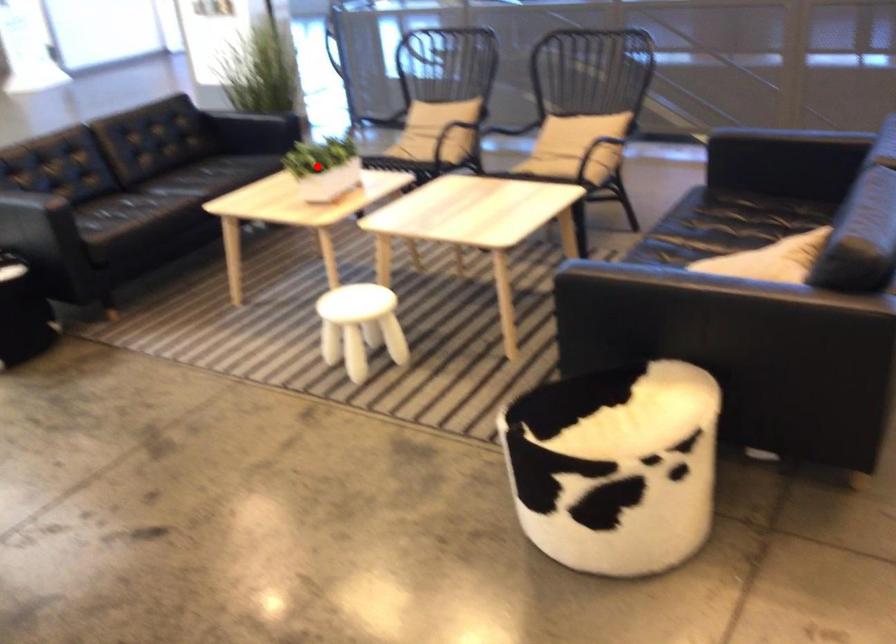
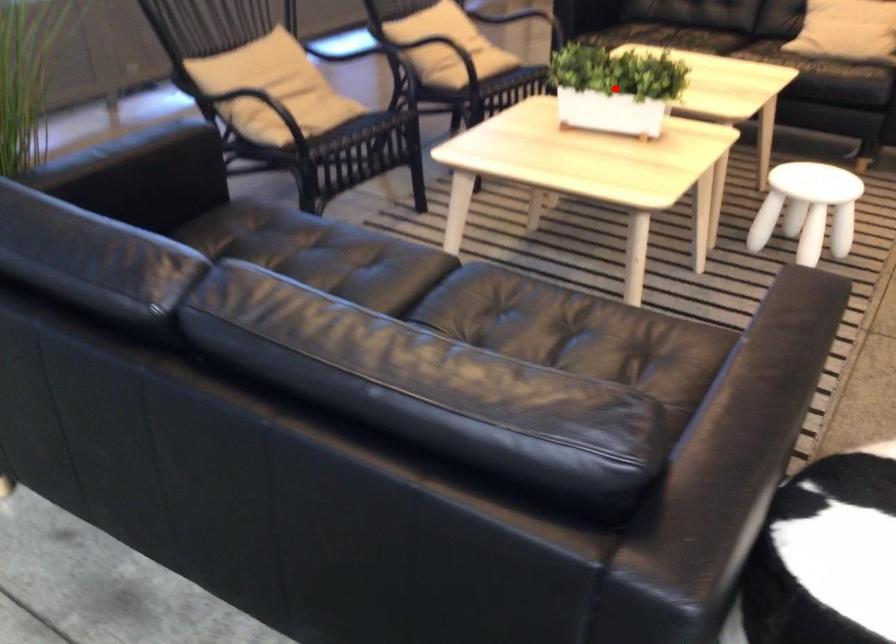
I am providing you with two images of the same scene from different viewpoints. A red point is marked on the first image and another point is marked on the second image. Does the point marked in image1 correspond to the same location as the one in image2?

Yes